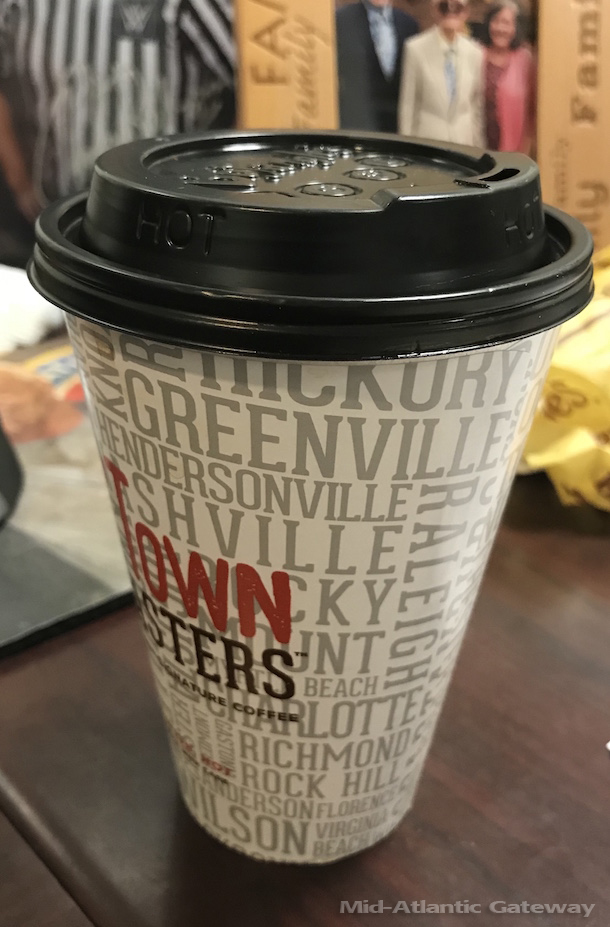
Where is `white cup, grey, red and black text`? white cup, grey, red and black text is located at coordinates (440, 434).